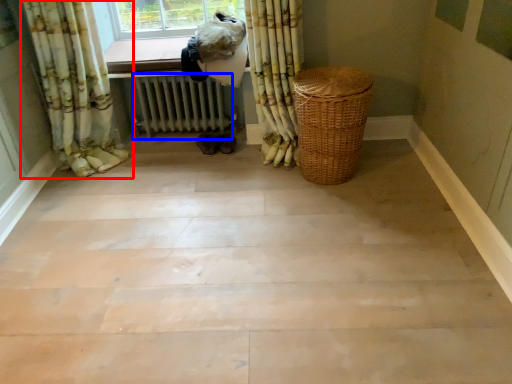
Question: Which object is further to the camera taking this photo, curtain (highlighted by a red box) or radiator (highlighted by a blue box)?

Choices:
 (A) curtain
 (B) radiator

Answer: (B)